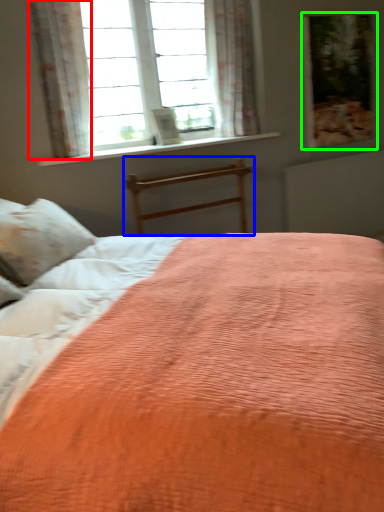
Question: Based on their relative distances, which object is nearer to curtain (highlighted by a red box)? Choose from bed frame (highlighted by a blue box) and picture frame (highlighted by a green box).

Choices:
 (A) bed frame
 (B) picture frame

Answer: (A)